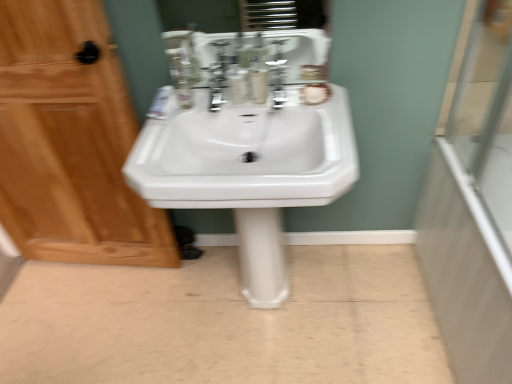
Measure the distance between point [495,111] and camera.

Point [495,111] and camera are 1.39 meters apart from each other.

In order to click on white glossy pedestal sink at center in this screenshot , I will do `click(224, 323)`.

What do you see at coordinates (277, 81) in the screenshot?
I see `satin nickel faucet at upper center` at bounding box center [277, 81].

Where is `transparent glass shower door at right`? The height and width of the screenshot is (384, 512). transparent glass shower door at right is located at coordinates (465, 272).

Locate an element on the screen. This screenshot has width=512, height=384. transparent glass door at right is located at coordinates (487, 112).

From the picture: From a real-world perspective, between transparent glass shower door at right and wooden cabinet at left, who is vertically lower?

transparent glass shower door at right.

Does transparent glass shower door at right lie behind wooden cabinet at left?

No, the depth of transparent glass shower door at right is less than that of wooden cabinet at left.

Locate an element on the screen. bath below the wooden cabinet at left (from a real-world perspective) is located at coordinates (465, 272).

Does transparent glass shower door at right have a greater height compared to white glossy pedestal sink at center?

Correct, transparent glass shower door at right is much taller as white glossy pedestal sink at center.

Locate an element on the screen. The height and width of the screenshot is (384, 512). bath on the right of white glossy pedestal sink at center is located at coordinates (465, 272).

Considering the points (422, 266) and (360, 364), which point is behind, point (422, 266) or point (360, 364)?

Positioned behind is point (422, 266).

Would you say transparent glass shower door at right is to the left or to the right of white glossy pedestal sink at center in the picture?

transparent glass shower door at right is to the right of white glossy pedestal sink at center.

I want to click on mouthwash that is under the translucent plastic mouthwash at center, marked as the 2th mouthwash in a left-to-right arrangement (from a real-world perspective), so point(238,84).

Can you confirm if translucent plastic mouthwash at center, positioned as the first mouthwash in left-to-right order, is thinner than translucent plastic mouthwash at center, marked as the 2th mouthwash in a left-to-right arrangement?

No.

Consider the image. Would you say translucent plastic mouthwash at center, marked as the 2th mouthwash in a right-to-left arrangement, is to the left or to the right of translucent plastic mouthwash at center, marked as the 2th mouthwash in a left-to-right arrangement, in the picture?

Clearly, translucent plastic mouthwash at center, marked as the 2th mouthwash in a right-to-left arrangement, is on the left of translucent plastic mouthwash at center, marked as the 2th mouthwash in a left-to-right arrangement, in the image.

From the image's perspective, is translucent plastic mouthwash at center, marked as the 2th mouthwash in a right-to-left arrangement, under translucent plastic mouthwash at center, which is the 1th mouthwash from right to left?

Indeed, from the image's perspective, translucent plastic mouthwash at center, marked as the 2th mouthwash in a right-to-left arrangement, is shown beneath translucent plastic mouthwash at center, which is the 1th mouthwash from right to left.

Which object is closer to the camera, transparent glass shower door at right or satin nickel faucet at upper center?

Positioned in front is transparent glass shower door at right.

Considering the positions of objects transparent glass shower door at right and satin nickel faucet at upper center in the image provided, who is more to the left, transparent glass shower door at right or satin nickel faucet at upper center?

From the viewer's perspective, satin nickel faucet at upper center appears more on the left side.

How far apart are transparent glass shower door at right and satin nickel faucet at upper center?

transparent glass shower door at right is 30.41 inches away from satin nickel faucet at upper center.

Which is correct: transparent glass shower door at right is inside satin nickel faucet at upper center, or outside of it?

transparent glass shower door at right lies outside satin nickel faucet at upper center.

Is translucent plastic mouthwash at center, which is the 1th mouthwash from right to left, wider than white glossy sink at center?

In fact, translucent plastic mouthwash at center, which is the 1th mouthwash from right to left, might be narrower than white glossy sink at center.

Which is closer to the camera, (263, 86) or (341, 140)?

Point (263, 86).

Is translucent plastic mouthwash at center, which is the 1th mouthwash from right to left, shorter than white glossy sink at center?

Yes, translucent plastic mouthwash at center, which is the 1th mouthwash from right to left, is shorter than white glossy sink at center.

There is a white glossy sink at center. At what (x,y) coordinates should I click in order to perform the action: click on the 2nd mouthwash above it (from the image's perspective). Please return your answer as a coordinate pair (x, y). Looking at the image, I should click on (258, 80).

Relative to white glossy pedestal sink at center, is white glossy sink at center in front or behind?

In the image, white glossy sink at center appears in front of white glossy pedestal sink at center.

Image resolution: width=512 pixels, height=384 pixels. Find the location of `plain behind the white glossy sink at center`. plain behind the white glossy sink at center is located at coordinates (224, 323).

Are white glossy sink at center and white glossy pedestal sink at center located far from each other?

That's not correct — white glossy sink at center is a little close to white glossy pedestal sink at center.

Considering the positions of objects translucent plastic mouthwash at center, marked as the 2th mouthwash in a left-to-right arrangement, and translucent plastic mouthwash at center, marked as the 2th mouthwash in a right-to-left arrangement, in the image provided, who is behind, translucent plastic mouthwash at center, marked as the 2th mouthwash in a left-to-right arrangement, or translucent plastic mouthwash at center, marked as the 2th mouthwash in a right-to-left arrangement,?

translucent plastic mouthwash at center, marked as the 2th mouthwash in a right-to-left arrangement, is further away from the camera.

Are translucent plastic mouthwash at center, marked as the 2th mouthwash in a left-to-right arrangement, and translucent plastic mouthwash at center, positioned as the first mouthwash in left-to-right order, far apart?

translucent plastic mouthwash at center, marked as the 2th mouthwash in a left-to-right arrangement, is actually quite close to translucent plastic mouthwash at center, positioned as the first mouthwash in left-to-right order.

Could you tell me if translucent plastic mouthwash at center, marked as the 2th mouthwash in a left-to-right arrangement, is facing translucent plastic mouthwash at center, positioned as the first mouthwash in left-to-right order?

No.

Locate an element on the screen. bath on the right of the wooden cabinet at left is located at coordinates (465, 272).

You are a GUI agent. You are given a task and a screenshot of the screen. Output one action in this format:
    pyautogui.click(x=<x>, y=<y>)
    Task: Click on the plain on the left of transparent glass shower door at right
    The image size is (512, 384).
    Given the screenshot: What is the action you would take?
    pyautogui.click(x=224, y=323)

Based on their spatial positions, is wooden cabinet at left or translucent plastic mouthwash at center, positioned as the first mouthwash in left-to-right order, closer to white glossy pedestal sink at center?

wooden cabinet at left is closer to white glossy pedestal sink at center.

From the image, which object appears to be nearer to wooden cabinet at left, transparent glass shower door at right or transparent glass door at right?

transparent glass shower door at right is positioned closer to the anchor wooden cabinet at left.

Which object lies nearer to the anchor point wooden cabinet at left, satin nickel faucet at upper center or transparent glass shower door at right?

Among the two, satin nickel faucet at upper center is located nearer to wooden cabinet at left.

Looking at the image, which one is located closer to translucent plastic mouthwash at center, positioned as the first mouthwash in left-to-right order, translucent plastic mouthwash at center, which is the 1th mouthwash from right to left, or white glossy sink at center?

The object closer to translucent plastic mouthwash at center, positioned as the first mouthwash in left-to-right order, is translucent plastic mouthwash at center, which is the 1th mouthwash from right to left.

Which object lies nearer to the anchor point transparent glass shower door at right, white glossy sink at center or white glossy pedestal sink at center?

The object closer to transparent glass shower door at right is white glossy pedestal sink at center.

When comparing their distances from translucent plastic mouthwash at center, positioned as the first mouthwash in left-to-right order, does transparent glass shower door at right or white glossy pedestal sink at center seem closer?

Among the two, transparent glass shower door at right is located nearer to translucent plastic mouthwash at center, positioned as the first mouthwash in left-to-right order.

When comparing their distances from transparent glass shower door at right, does white glossy sink at center or translucent plastic mouthwash at center, which is the 1th mouthwash from right to left, seem further?

translucent plastic mouthwash at center, which is the 1th mouthwash from right to left, is further to transparent glass shower door at right.

When comparing their distances from wooden cabinet at left, does white glossy sink at center or transparent glass door at right seem further?

transparent glass door at right lies further to wooden cabinet at left than the other object.

Locate an element on the screen. mouthwash situated between translucent plastic mouthwash at center, marked as the 2th mouthwash in a right-to-left arrangement, and transparent glass shower door at right from left to right is located at coordinates (258, 80).

Locate an element on the screen. This screenshot has height=384, width=512. glass door between translucent plastic mouthwash at center, marked as the 2th mouthwash in a left-to-right arrangement, and transparent glass shower door at right is located at coordinates (487, 112).

Find the location of a particular element. sink between white glossy pedestal sink at center and transparent glass shower door at right is located at coordinates (243, 153).

This screenshot has height=384, width=512. I want to click on plain between wooden cabinet at left and transparent glass door at right in the horizontal direction, so click(x=224, y=323).